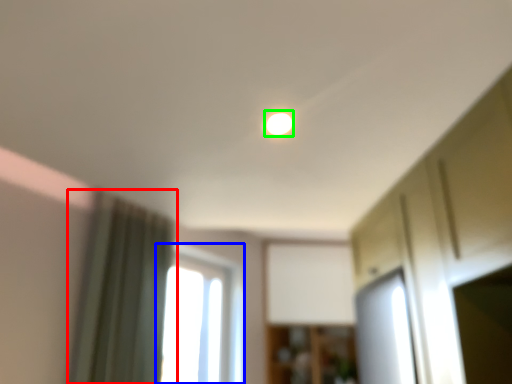
Question: Based on their relative distances, which object is farther from curtain (highlighted by a red box)? Choose from window (highlighted by a blue box) and light (highlighted by a green box).

Choices:
 (A) window
 (B) light

Answer: (A)